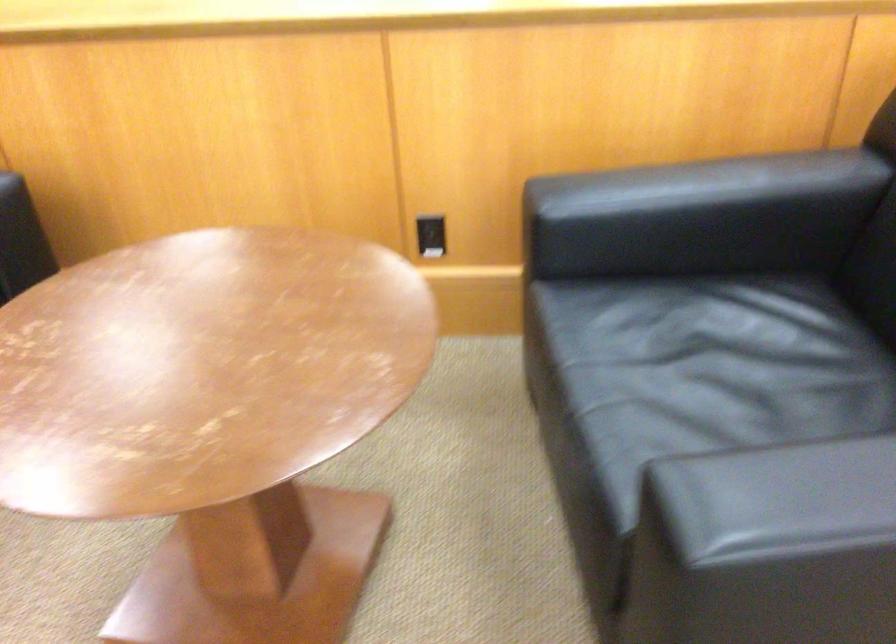
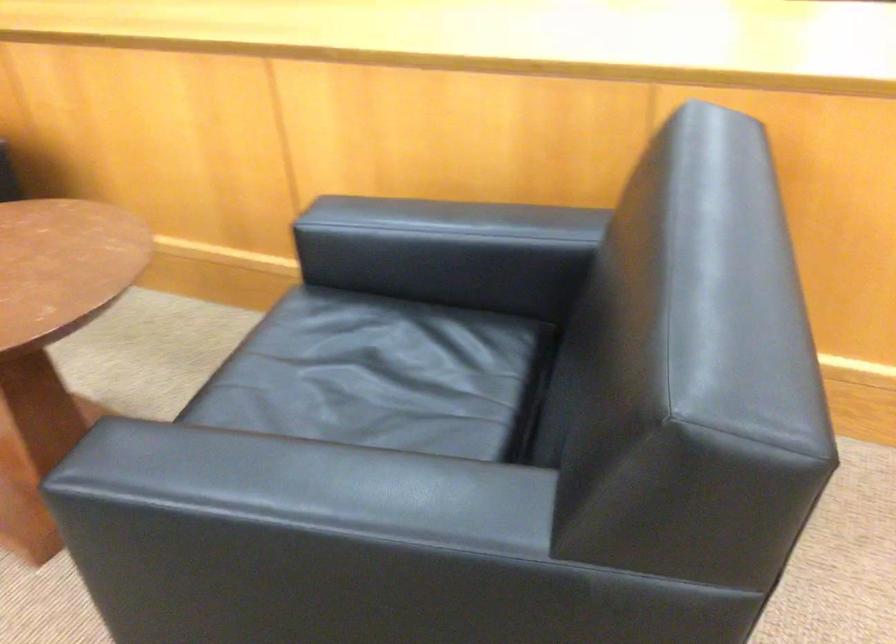
Question: In a continuous first-person perspective shot, in which direction is the camera moving?

Choices:
 (A) Left
 (B) Right
 (C) Forward
 (D) Backward

Answer: (B)